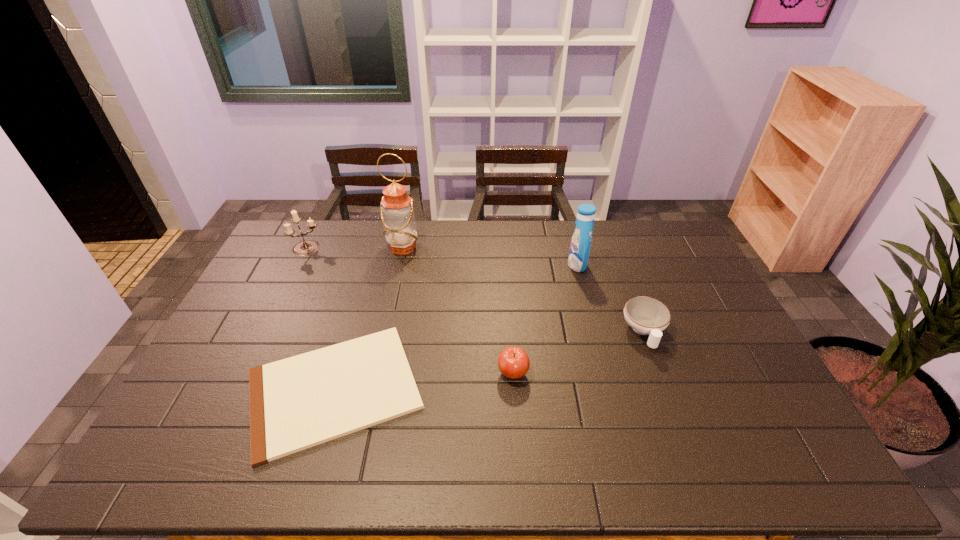
Where is `the tallest object`? This screenshot has height=540, width=960. the tallest object is located at coordinates (397, 214).

In order to click on detergent in this screenshot , I will do `click(581, 240)`.

What are the coordinates of `the fifth shortest object` in the screenshot? It's located at (581, 240).

Where is `the third tallest object`? the third tallest object is located at coordinates (305, 247).

Locate an element on the screen. This screenshot has width=960, height=540. apple is located at coordinates (513, 362).

The image size is (960, 540). I want to click on the fourth tallest object, so click(x=513, y=362).

Identify the location of chinaware. (646, 315).

Identify the location of the second shortest object. The height and width of the screenshot is (540, 960). (646, 315).

Find the location of a particular element. Image resolution: width=960 pixels, height=540 pixels. clipboard is located at coordinates (x=296, y=403).

Where is `vacant space situated on the front of the tallest object`? The height and width of the screenshot is (540, 960). vacant space situated on the front of the tallest object is located at coordinates (390, 303).